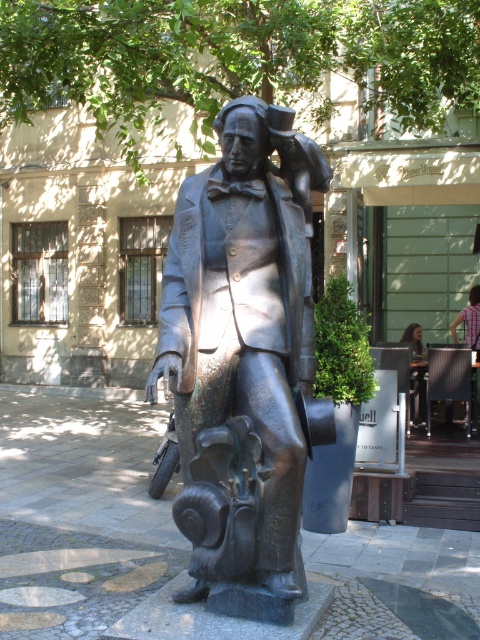
Question: Can you confirm if plaid fabric shirt at upper right is positioned above dark hair person at center?

Choices:
 (A) no
 (B) yes

Answer: (B)

Question: Does bronze statue at center have a smaller size compared to dark hair person at center?

Choices:
 (A) no
 (B) yes

Answer: (A)

Question: Which object is the farthest from the bronze statue at center?

Choices:
 (A) plaid fabric shirt at upper right
 (B) dark hair person at center

Answer: (A)

Question: Does bronze statue at center have a smaller size compared to dark hair person at center?

Choices:
 (A) yes
 (B) no

Answer: (B)

Question: Which point is farther to the camera?

Choices:
 (A) plaid fabric shirt at upper right
 (B) dark hair person at center
 (C) bronze statue at center

Answer: (A)

Question: Which point is closer to the camera?

Choices:
 (A) dark hair person at center
 (B) bronze statue at center
 (C) plaid fabric shirt at upper right

Answer: (B)